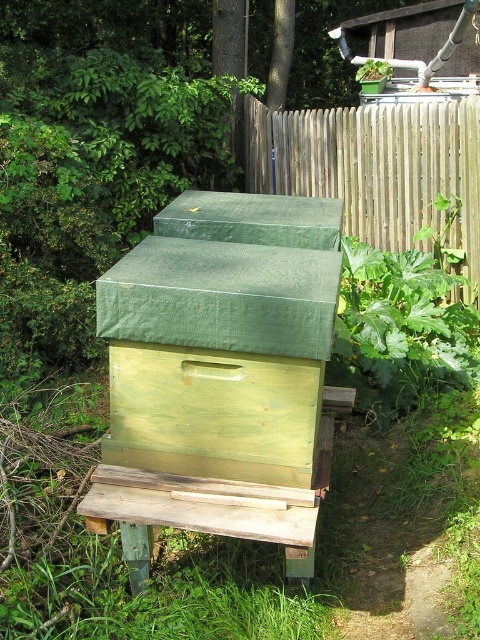
Can you confirm if green painted wood beehive at center is wider than wooden fence at upper center?

Incorrect, green painted wood beehive at center's width does not surpass wooden fence at upper center's.

Does point (154, 394) come closer to viewer compared to point (380, 120)?

Yes, point (154, 394) is closer to viewer.

Identify the location of green painted wood beehive at center. (218, 372).

In order to click on green painted wood beehive at center in this screenshot , I will do `click(218, 372)`.